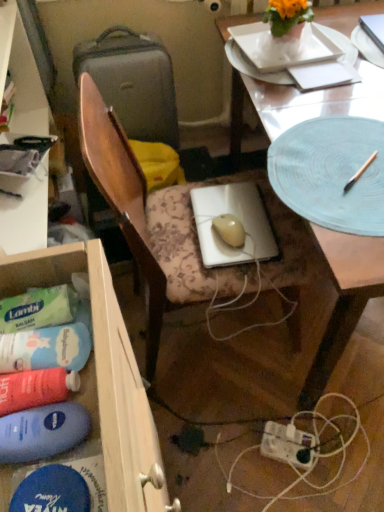
Question: Is light blue textured platter at upper right not near blue matte paper plate at upper right?

Choices:
 (A) no
 (B) yes

Answer: (A)

Question: Are light blue textured platter at upper right and blue matte paper plate at upper right beside each other?

Choices:
 (A) no
 (B) yes

Answer: (A)

Question: Does light blue textured platter at upper right have a greater width compared to blue matte paper plate at upper right?

Choices:
 (A) yes
 (B) no

Answer: (A)

Question: Is light blue textured platter at upper right thinner than blue matte paper plate at upper right?

Choices:
 (A) no
 (B) yes

Answer: (A)

Question: Does light blue textured platter at upper right have a smaller size compared to blue matte paper plate at upper right?

Choices:
 (A) no
 (B) yes

Answer: (B)

Question: Is light blue textured platter at upper right completely or partially outside of blue matte paper plate at upper right?

Choices:
 (A) yes
 (B) no

Answer: (A)

Question: From the image's perspective, is white paper at upper right below white plastic power plugs and sockets at lower center?

Choices:
 (A) yes
 (B) no

Answer: (B)

Question: Considering the relative positions of white paper at upper right and white plastic power plugs and sockets at lower center in the image provided, is white paper at upper right to the left of white plastic power plugs and sockets at lower center from the viewer's perspective?

Choices:
 (A) no
 (B) yes

Answer: (A)

Question: Does white paper at upper right have a larger size compared to white plastic power plugs and sockets at lower center?

Choices:
 (A) yes
 (B) no

Answer: (B)

Question: Is white paper at upper right taller than white plastic power plugs and sockets at lower center?

Choices:
 (A) no
 (B) yes

Answer: (A)

Question: Is the depth of white paper at upper right greater than that of white plastic power plugs and sockets at lower center?

Choices:
 (A) no
 (B) yes

Answer: (A)

Question: Is white plastic power plugs and sockets at lower center a part of white paper at upper right?

Choices:
 (A) no
 (B) yes

Answer: (A)

Question: Would you consider white plastic power plugs and sockets at lower center to be distant from blue matte paper plate at upper right?

Choices:
 (A) no
 (B) yes

Answer: (B)